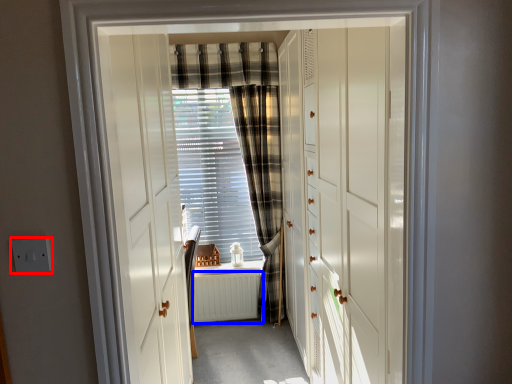
Question: Which object is closer to the camera taking this photo, electric outlet (highlighted by a red box) or radiator (highlighted by a blue box)?

Choices:
 (A) electric outlet
 (B) radiator

Answer: (A)